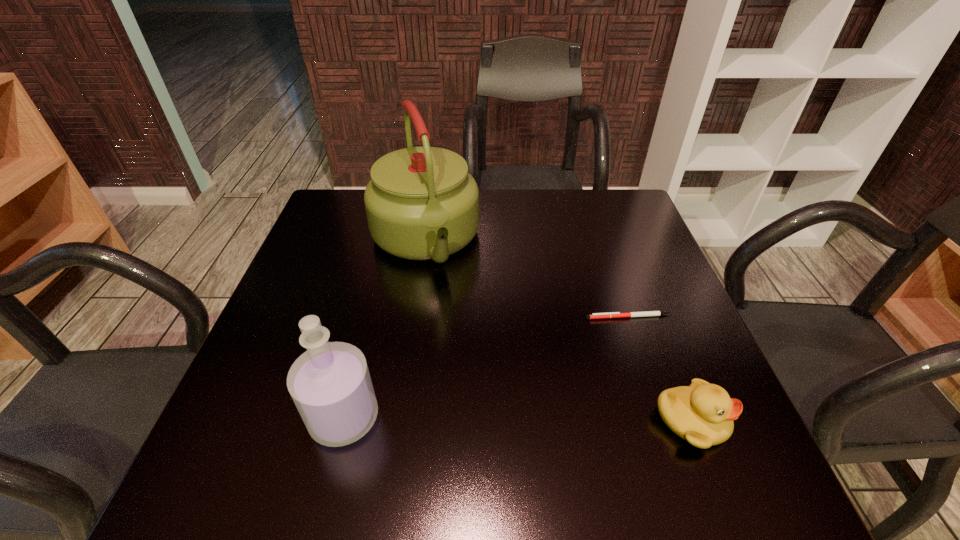
This screenshot has height=540, width=960. I want to click on object that is at the far left corner, so click(x=421, y=203).

At what (x,y) coordinates should I click in order to perform the action: click on object that is at the near left corner. Please return your answer as a coordinate pair (x, y). The image size is (960, 540). Looking at the image, I should click on (330, 384).

The width and height of the screenshot is (960, 540). Find the location of `object present at the near right corner`. object present at the near right corner is located at coordinates (702, 414).

In the image, there is a desktop. Where is `vacant space at the far edge`? The height and width of the screenshot is (540, 960). vacant space at the far edge is located at coordinates (562, 193).

Identify the location of free space at the near edge. The width and height of the screenshot is (960, 540). (625, 408).

Identify the location of free space at the left edge of the desktop. The image size is (960, 540). (286, 328).

This screenshot has width=960, height=540. Identify the location of blank space at the right edge of the desktop. (674, 308).

You are a GUI agent. You are given a task and a screenshot of the screen. Output one action in this format:
    pyautogui.click(x=<x>, y=<y>)
    Task: Click on the free location at the far left corner
    
    Given the screenshot: What is the action you would take?
    (x=335, y=237)

This screenshot has height=540, width=960. In order to click on vacant space at the near left corner of the desktop in this screenshot , I will do `click(251, 406)`.

In order to click on blank space at the near right corner in this screenshot , I will do `click(655, 434)`.